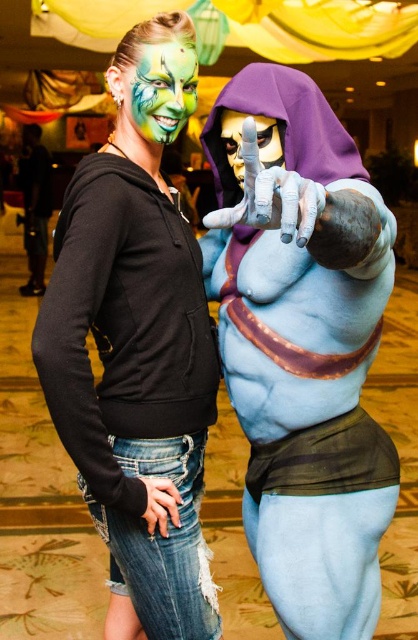
This screenshot has width=418, height=640. I want to click on green matte face paint at upper center, so click(160, 90).

Is green matte face paint at upper center thinner than gold metallic mask at center?

In fact, green matte face paint at upper center might be wider than gold metallic mask at center.

Does point (142, 58) come closer to viewer compared to point (234, 113)?

That is True.

Where is `green matte face paint at upper center`? Image resolution: width=418 pixels, height=640 pixels. green matte face paint at upper center is located at coordinates click(160, 90).

Does black matte hoodie at center appear over green matte face paint at upper center?

Incorrect, black matte hoodie at center is not positioned above green matte face paint at upper center.

Does point (183, 332) come farther from viewer compared to point (186, 64)?

Yes, point (183, 332) is behind point (186, 64).

What do you see at coordinates (137, 346) in the screenshot? I see `black matte hoodie at center` at bounding box center [137, 346].

Find the location of a particular element. black matte hoodie at center is located at coordinates (137, 346).

Is black matte hoodie at center positioned in front of gold metallic mask at center?

Yes, it is.

Who is positioned more to the right, black matte hoodie at center or gold metallic mask at center?

From the viewer's perspective, gold metallic mask at center appears more on the right side.

Describe the element at coordinates (137, 346) in the screenshot. I see `black matte hoodie at center` at that location.

Find the location of a particular element. black matte hoodie at center is located at coordinates (137, 346).